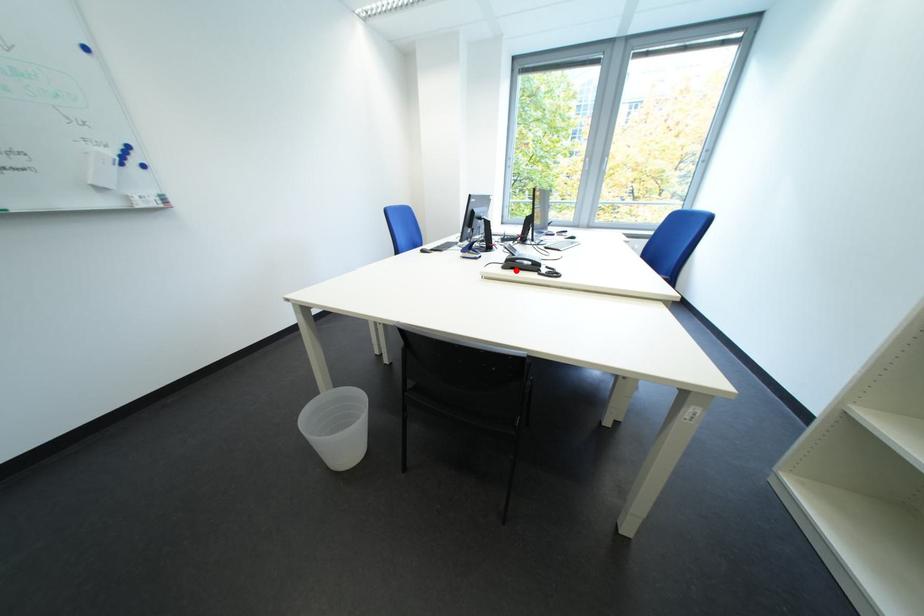
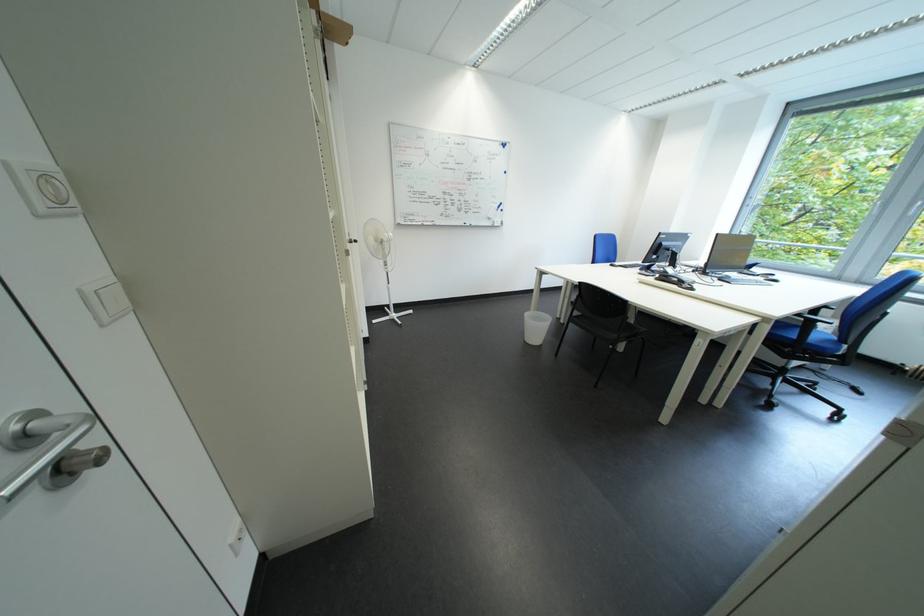
In the second image, find the point that corresponds to the highlighted location in the first image.

(669, 282)